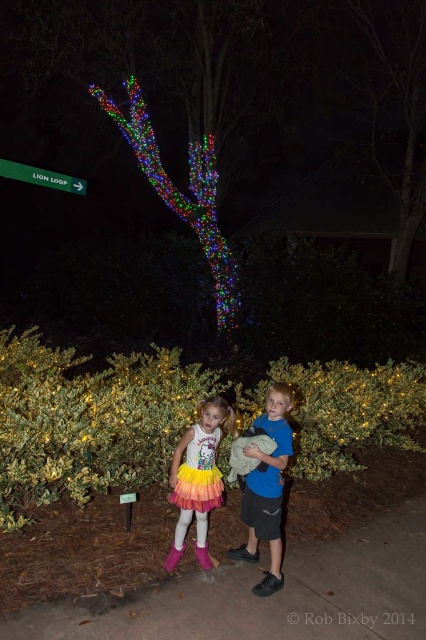
You are a photographer setting up for a night shoot. You have two items in the scene to consider for lighting adjustments. The green leafy bush at lower center and the green plastic sign at upper left. Which one is located to the right of the other?

The green leafy bush at lower center is positioned on the right side of green plastic sign at upper left.

You are a photographer trying to capture the children in front of the decorative tree. You notice the gray concrete pavement at lower center and the colorful lights at upper center. Based on their positions, which object is located to the right side of the other?

The gray concrete pavement at lower center is located to the right of the colorful lights at upper center.

You are a photographer trying to capture a photo of the green leafy bush at lower center and the green plastic sign at upper left. Which object should you focus on first if you want to ensure both are in the frame without moving the camera?

The green leafy bush at lower center should be focused on first because it is larger in size than the green plastic sign at upper left, so it will take up more space in the frame.